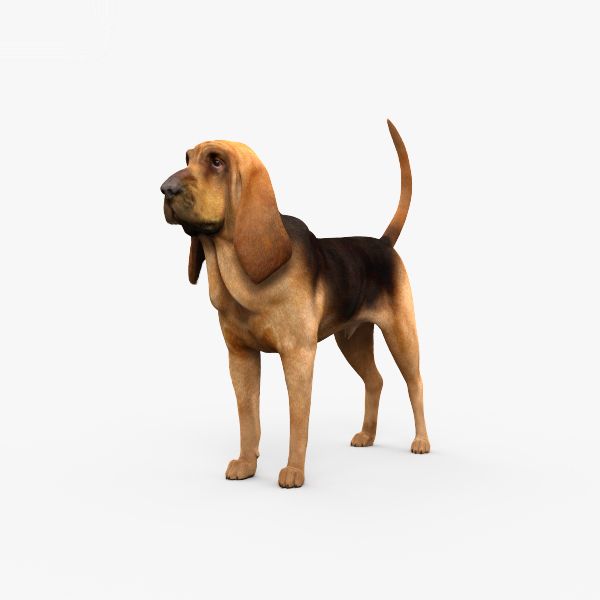
You are a GUI agent. You are given a task and a screenshot of the screen. Output one action in this format:
    pyautogui.click(x=<x>, y=<y>)
    Task: Click on the chest
    
    Given the screenshot: What is the action you would take?
    pyautogui.click(x=245, y=312)